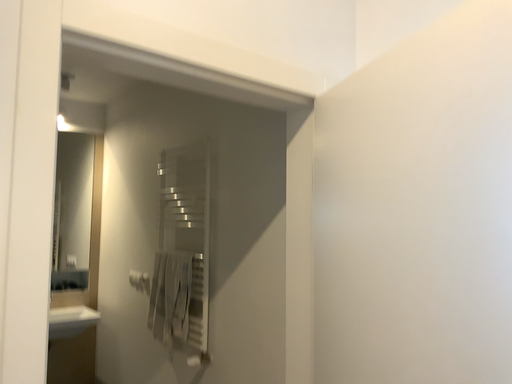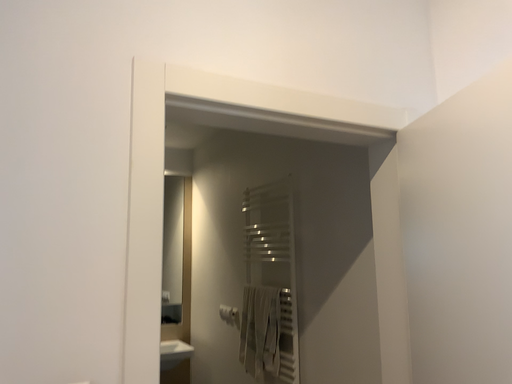
Question: How did the camera likely rotate when shooting the video?

Choices:
 (A) rotated right
 (B) rotated left

Answer: (B)